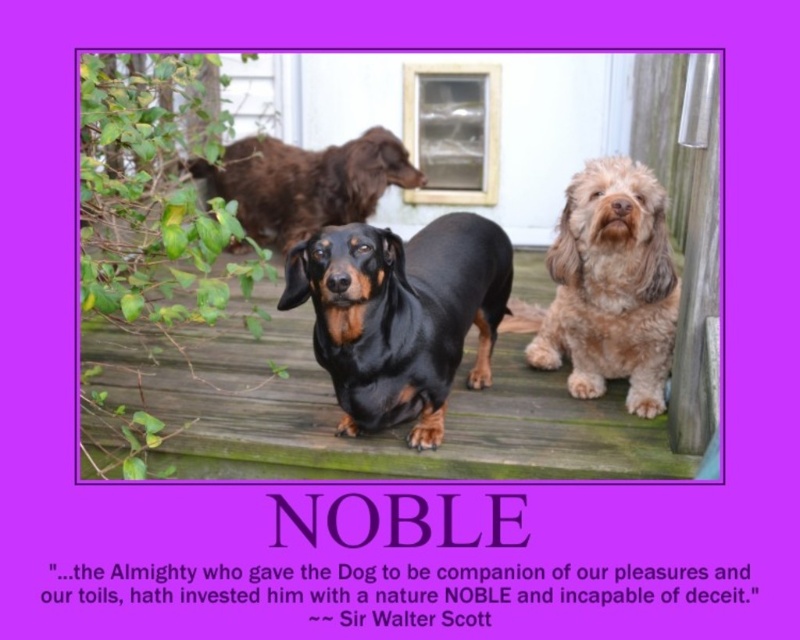
Question: Can you confirm if black shiny dachshund at center is bigger than fuzzy brown dog at center?

Choices:
 (A) yes
 (B) no

Answer: (A)

Question: Is fuzzy brown dog at center wider than shiny brown fur at upper center?

Choices:
 (A) no
 (B) yes

Answer: (A)

Question: Among these objects, which one is farthest from the camera?

Choices:
 (A) shiny brown fur at upper center
 (B) black shiny dachshund at center
 (C) fuzzy brown dog at center

Answer: (A)

Question: Is black shiny dachshund at center wider than shiny brown fur at upper center?

Choices:
 (A) no
 (B) yes

Answer: (A)

Question: Which object is closer to the camera taking this photo?

Choices:
 (A) fuzzy brown dog at center
 (B) black shiny dachshund at center

Answer: (B)

Question: Which point is farther to the camera?

Choices:
 (A) fuzzy brown dog at center
 (B) black shiny dachshund at center
 (C) shiny brown fur at upper center

Answer: (C)